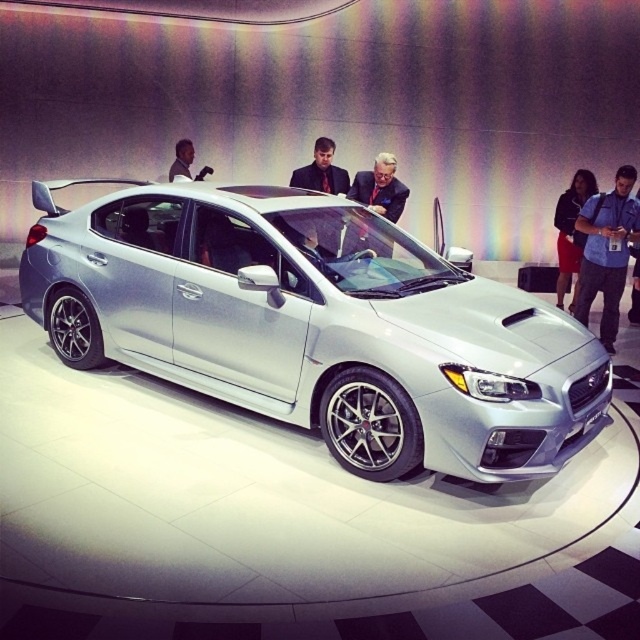
You are standing at the entrance of the auto show and see the silver Subaru WRX STI displayed on a circular platform. There are two points marked on the car, one at point coordinates [156,196] and another at [628,320]. Which of these two points is nearer to your current position?

Point [156,196] is closer to the camera than point [628,320], so the point at coordinates [156,196] is nearer to your current position.

You are a photographer standing at the auto show and want to take a photo of the silver metallic car at center and the dark skin smooth face at upper center in the same frame. The minimum distance between the two subjects to ensure both are in focus is 4 meters. Can you capture both subjects clearly in one shot?

The silver metallic car at center is 3.92 meters from dark skin smooth face at upper center. Since the required minimum distance is 4 meters, the photographer cannot capture both subjects clearly in one shot as the distance is slightly less than required.